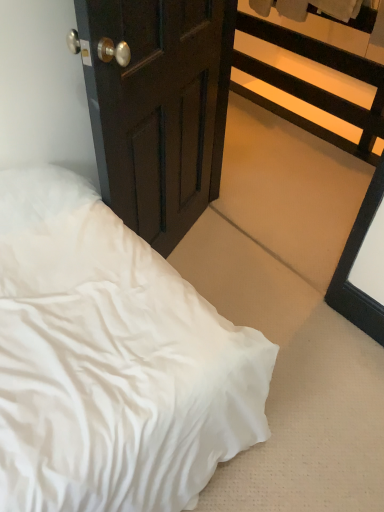
Question: Looking at the image, does black wood balustrade at upper right seem bigger or smaller compared to white satin bed at lower left?

Choices:
 (A) small
 (B) big

Answer: (B)

Question: Would you say black wood balustrade at upper right is inside or outside white satin bed at lower left?

Choices:
 (A) inside
 (B) outside

Answer: (B)

Question: Which is nearer to the dark wood door at center?

Choices:
 (A) white satin bed at lower left
 (B) black wood balustrade at upper right

Answer: (A)

Question: Based on their relative distances, which object is nearer to the black wood balustrade at upper right?

Choices:
 (A) dark wood door at center
 (B) white satin bed at lower left

Answer: (A)